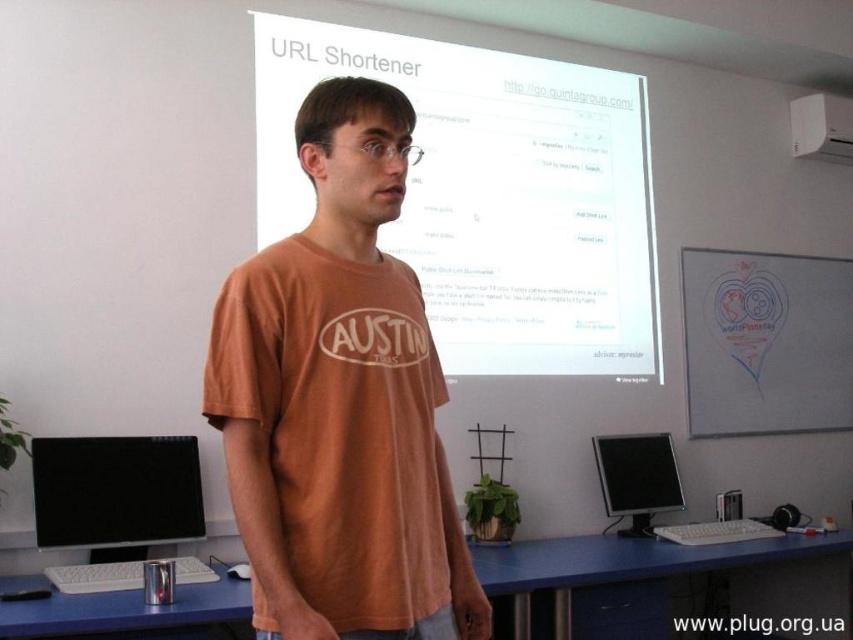
Does black glossy monitor at lower left have a lesser height compared to black glossy monitor at right?

Yes.

Does black glossy monitor at lower left lie in front of black glossy monitor at right?

Yes, black glossy monitor at lower left is in front of black glossy monitor at right.

Is point (106, 524) in front of point (634, 513)?

Yes, it is.

Where is `black glossy monitor at lower left`? The height and width of the screenshot is (640, 853). black glossy monitor at lower left is located at coordinates (115, 490).

Does whiteboard at upper right come in front of black glossy monitor at right?

No, whiteboard at upper right is further to the viewer.

Is whiteboard at upper right bigger than black glossy monitor at right?

Correct, whiteboard at upper right is larger in size than black glossy monitor at right.

The height and width of the screenshot is (640, 853). What do you see at coordinates (766, 342) in the screenshot?
I see `whiteboard at upper right` at bounding box center [766, 342].

Find the location of a particular element. whiteboard at upper right is located at coordinates (766, 342).

Does point (602, 488) come in front of point (834, 106)?

Yes, point (602, 488) is in front of point (834, 106).

Between point (634, 493) and point (816, 141), which one is positioned in front?

Positioned in front is point (634, 493).

Identify the location of black glossy monitor at right. (637, 474).